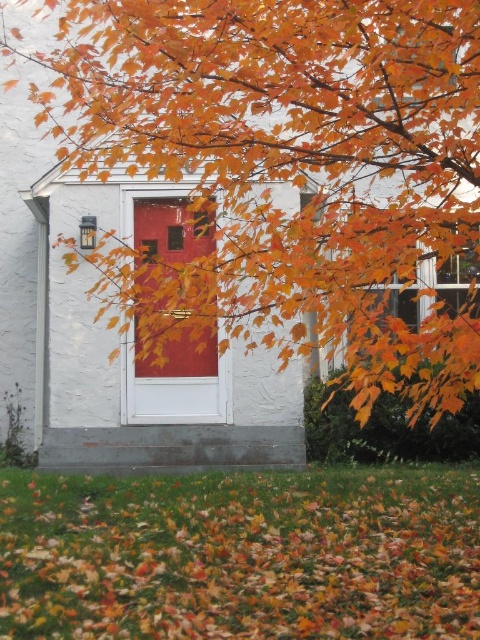
Does point (166, 486) come closer to viewer compared to point (136, 228)?

Yes, it is in front of point (136, 228).

Which is behind, point (475, 628) or point (214, 401)?

The point (214, 401) is more distant.

Describe the element at coordinates (240, 556) in the screenshot. I see `orange leaf litter at lower center` at that location.

Identify the location of orange leaf litter at lower center. This screenshot has height=640, width=480. (240, 556).

Which of these two, orange leafy branches at center or orange leaf litter at lower center, stands taller?

Standing taller between the two is orange leafy branches at center.

Is orange leafy branches at center positioned at the back of orange leaf litter at lower center?

No.

Which is behind, point (421, 10) or point (402, 516)?

Point (402, 516)

This screenshot has width=480, height=640. What are the coordinates of `orange leafy branches at center` in the screenshot? It's located at (286, 170).

The width and height of the screenshot is (480, 640). I want to click on orange leafy branches at center, so click(x=286, y=170).

Who is more forward, (361, 211) or (137, 385)?

Point (361, 211) is more forward.

Find the location of a particular element. The image size is (480, 640). orange leafy branches at center is located at coordinates (286, 170).

Identify the location of orange leafy branches at center. The height and width of the screenshot is (640, 480). (286, 170).